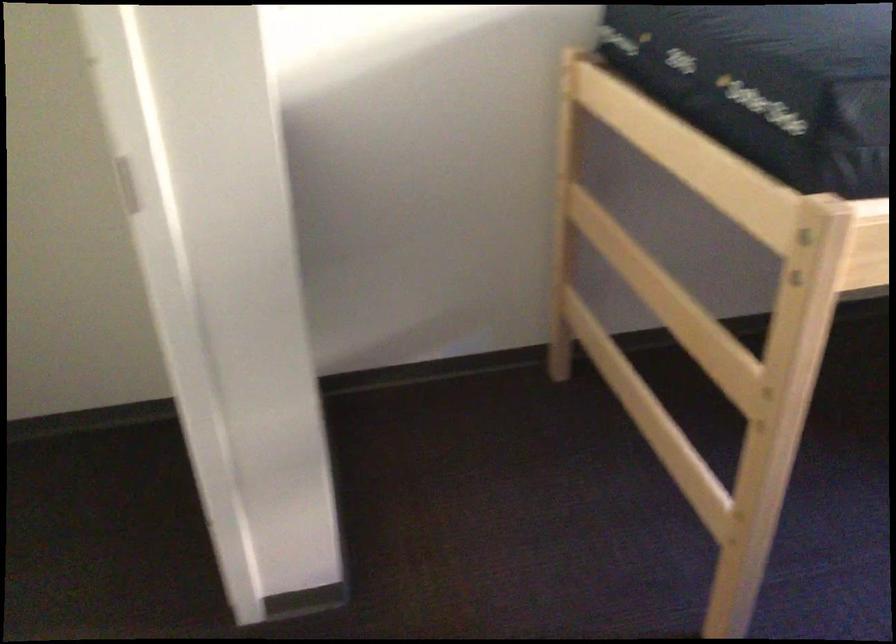
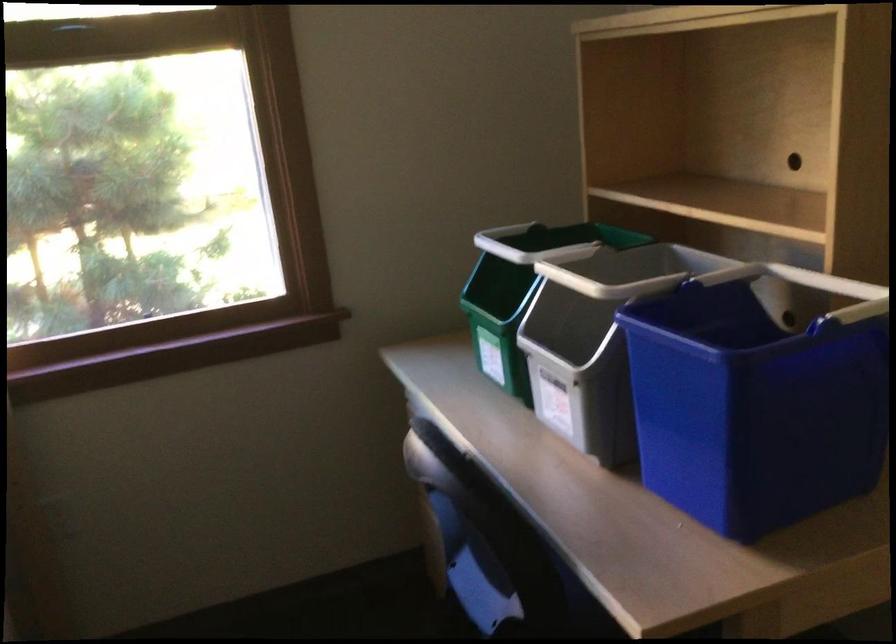
In the scene shown: First-person continuous shooting, in which direction is the camera rotating?

The camera rotated toward right-down.